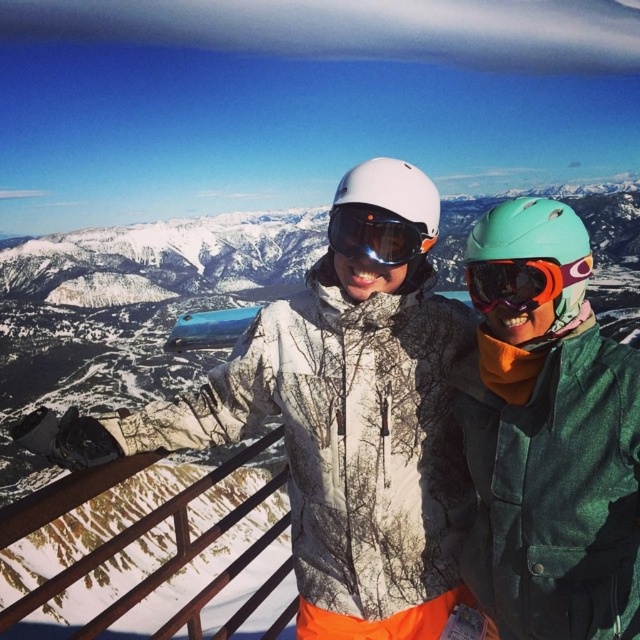
What do you see at coordinates (522, 282) in the screenshot?
I see `matte orange goggles at center` at bounding box center [522, 282].

Is matte orange goggles at center wider than transparent plastic goggles at center?

In fact, matte orange goggles at center might be narrower than transparent plastic goggles at center.

Image resolution: width=640 pixels, height=640 pixels. I want to click on matte orange goggles at center, so click(x=522, y=282).

Does matte green helmet at center have a smaller size compared to transparent plastic goggles at center?

Actually, matte green helmet at center might be larger than transparent plastic goggles at center.

The height and width of the screenshot is (640, 640). Identify the location of matte green helmet at center. (548, 435).

Between point (513, 461) and point (420, 241), which one is positioned behind?

The point (420, 241) is more distant.

Locate an element on the screen. The width and height of the screenshot is (640, 640). matte green helmet at center is located at coordinates (548, 435).

Which is behind, point (444, 467) or point (560, 376)?

Positioned behind is point (444, 467).

Does camouflage jacket at center appear on the right side of matte green helmet at center?

Incorrect, camouflage jacket at center is not on the right side of matte green helmet at center.

Locate an element on the screen. The width and height of the screenshot is (640, 640). camouflage jacket at center is located at coordinates (330, 438).

At what (x,y) coordinates should I click in order to perform the action: click on camouflage jacket at center. Please return your answer as a coordinate pair (x, y). Image resolution: width=640 pixels, height=640 pixels. Looking at the image, I should click on (330, 438).